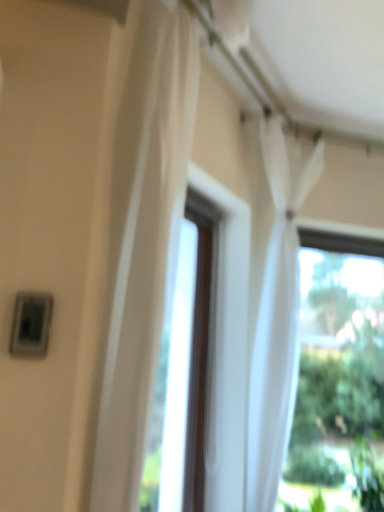
Question: Which direction should I rotate to look at white sheer curtain at center, the 1th curtain positioned from the front, — up or down?

Choices:
 (A) up
 (B) down

Answer: (A)

Question: Is white sheer curtain at upper center, which is the 1th curtain in back-to-front order, thinner than white sheer curtain at center, the 1th curtain positioned from the front?

Choices:
 (A) yes
 (B) no

Answer: (A)

Question: Does white sheer curtain at upper center, which is the first curtain in right-to-left order, have a larger size compared to white sheer curtain at center, which appears as the first curtain when viewed from the left?

Choices:
 (A) no
 (B) yes

Answer: (A)

Question: Can you confirm if white sheer curtain at upper center, the 2th curtain from the left, is wider than white sheer curtain at center, the 2th curtain positioned from the back?

Choices:
 (A) no
 (B) yes

Answer: (A)

Question: Is white sheer curtain at upper center, the second curtain when ordered from front to back, facing away from white sheer curtain at center, which is the second curtain in right-to-left order?

Choices:
 (A) yes
 (B) no

Answer: (B)

Question: Is white sheer curtain at upper center, the 2th curtain from the left, to the right of white sheer curtain at center, the 1th curtain positioned from the front, from the viewer's perspective?

Choices:
 (A) no
 (B) yes

Answer: (B)

Question: From a real-world perspective, is white sheer curtain at upper center, which is the first curtain in right-to-left order, beneath white sheer curtain at center, the 1th curtain positioned from the front?

Choices:
 (A) yes
 (B) no

Answer: (A)

Question: From a real-world perspective, is white sheer curtain at center, the 1th curtain positioned from the front, positioned over white sheer curtain at upper center, the second curtain when ordered from front to back, based on gravity?

Choices:
 (A) no
 (B) yes

Answer: (B)

Question: Can you confirm if white sheer curtain at center, which appears as the first curtain when viewed from the left, is taller than white sheer curtain at upper center, the 2th curtain from the left?

Choices:
 (A) no
 (B) yes

Answer: (A)

Question: From the image's perspective, does white sheer curtain at center, the 2th curtain positioned from the back, appear higher than white sheer curtain at upper center, the 2th curtain from the left?

Choices:
 (A) yes
 (B) no

Answer: (A)

Question: Can you confirm if white sheer curtain at center, the 1th curtain positioned from the front, is bigger than white sheer curtain at upper center, the 2th curtain from the left?

Choices:
 (A) yes
 (B) no

Answer: (A)

Question: Is white sheer curtain at center, the 1th curtain positioned from the front, to the left of white sheer curtain at upper center, the 2th curtain from the left, from the viewer's perspective?

Choices:
 (A) yes
 (B) no

Answer: (A)

Question: Does white sheer curtain at center, which appears as the first curtain when viewed from the left, have a greater width compared to white sheer curtain at upper center, which is the first curtain in right-to-left order?

Choices:
 (A) no
 (B) yes

Answer: (B)

Question: In terms of height, does white sheer curtain at center, which is the second curtain in right-to-left order, look taller or shorter compared to white sheer curtain at upper center, the second curtain when ordered from front to back?

Choices:
 (A) short
 (B) tall

Answer: (A)